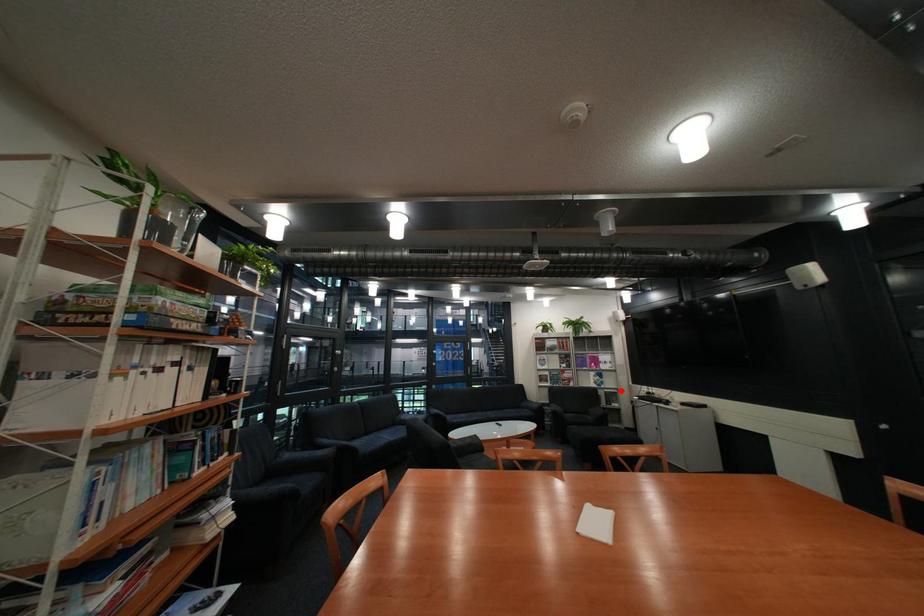
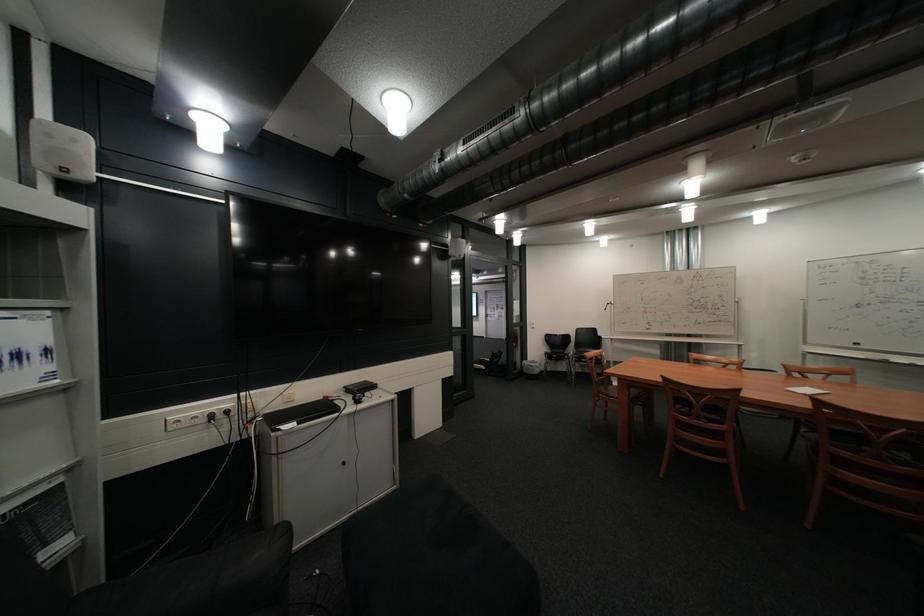
Question: I am providing you with two images of the same scene from different viewpoints. A red point is shown in image1. For the corresponding object point in image2, is it positioned nearer or farther from the camera?

Choices:
 (A) Nearer
 (B) Farther

Answer: (A)